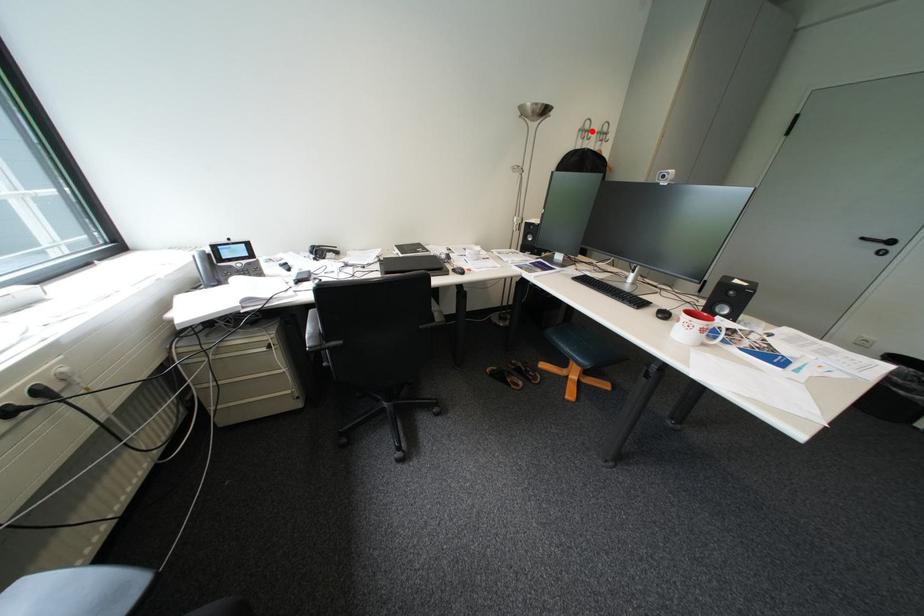
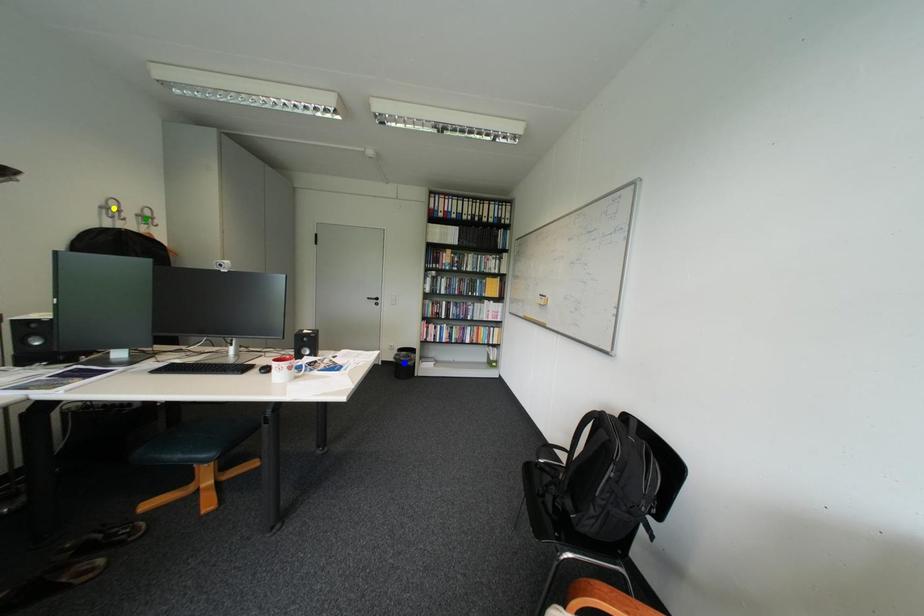
Question: I am providing you with two images of the same scene from different viewpoints. A red point is marked on the first image. You are given multiple points on the second image. Which mark in image 2 goes with the point in image 1?

Choices:
 (A) blue point
 (B) green point
 (C) yellow point

Answer: (C)